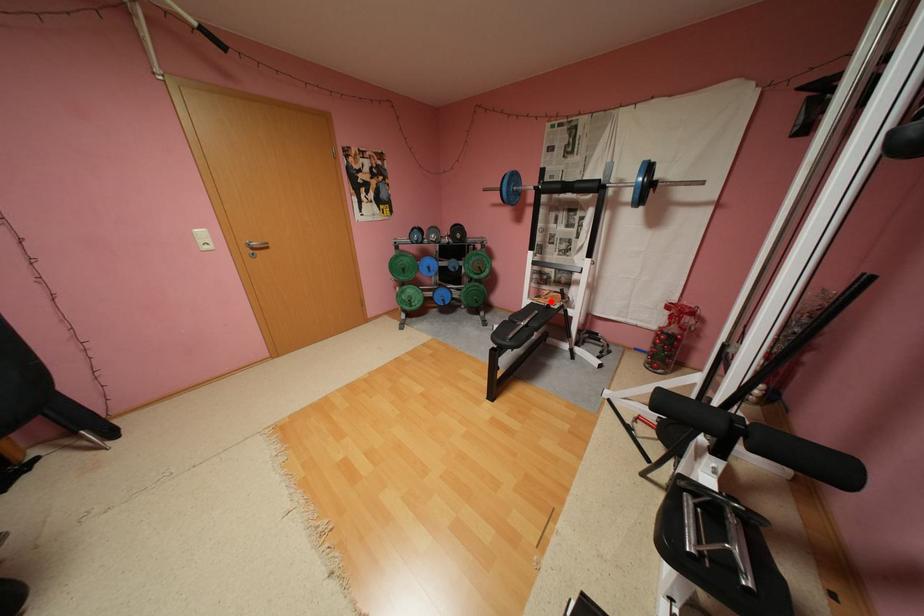
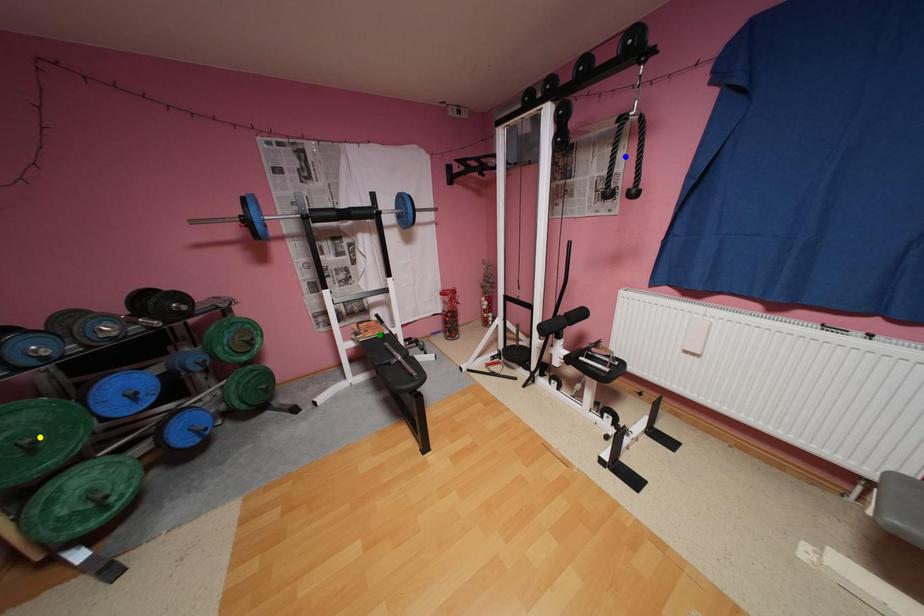
Question: I am providing you with two images of the same scene from different viewpoints. A red point is marked on the first image. You are given multiple points on the second image. Which spot in image 2 lines up with the point in image 1?

Choices:
 (A) yellow point
 (B) blue point
 (C) green point

Answer: (C)